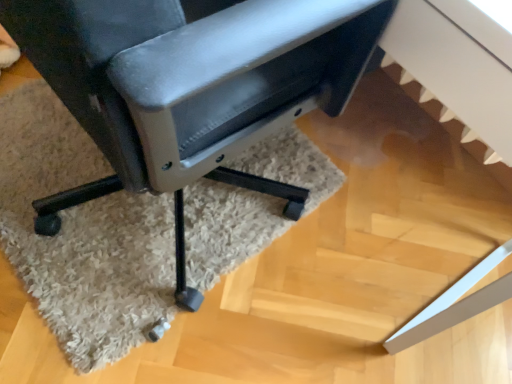
Question: In the image, is beige shaggy rug at lower center positioned in front of or behind matte black chair at center?

Choices:
 (A) behind
 (B) front

Answer: (A)

Question: From a real-world perspective, is beige shaggy rug at lower center physically located above or below matte black chair at center?

Choices:
 (A) above
 (B) below

Answer: (B)

Question: From their relative heights in the image, would you say beige shaggy rug at lower center is taller or shorter than matte black chair at center?

Choices:
 (A) short
 (B) tall

Answer: (A)

Question: Is matte black chair at center situated inside beige shaggy rug at lower center or outside?

Choices:
 (A) inside
 (B) outside

Answer: (B)

Question: Does point (15, 39) appear closer or farther from the camera than point (156, 253)?

Choices:
 (A) closer
 (B) farther

Answer: (A)

Question: From a real-world perspective, is matte black chair at center above or below beige shaggy rug at lower center?

Choices:
 (A) below
 (B) above

Answer: (B)

Question: Considering the positions of matte black chair at center and beige shaggy rug at lower center in the image, is matte black chair at center bigger or smaller than beige shaggy rug at lower center?

Choices:
 (A) big
 (B) small

Answer: (A)